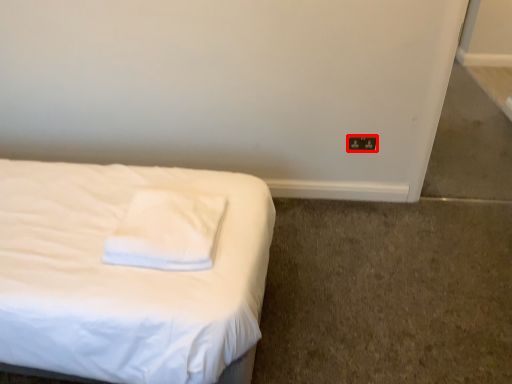
Question: Considering the relative positions of electric outlet (annotated by the red box) and pillow in the image provided, where is electric outlet (annotated by the red box) located with respect to the staircase?

Choices:
 (A) right
 (B) left

Answer: (A)